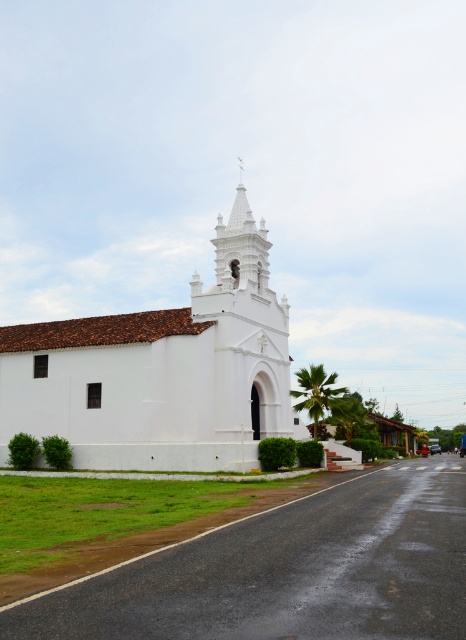
Is white matte church at center below white stucco spire at upper center?

Correct, white matte church at center is located below white stucco spire at upper center.

Which is in front, point (73, 344) or point (234, 218)?

Point (73, 344) is in front.

You are a GUI agent. You are given a task and a screenshot of the screen. Output one action in this format:
    pyautogui.click(x=<x>, y=<y>)
    Task: Click on the white matte church at center
    The height and width of the screenshot is (640, 466).
    Given the screenshot: What is the action you would take?
    pyautogui.click(x=163, y=371)